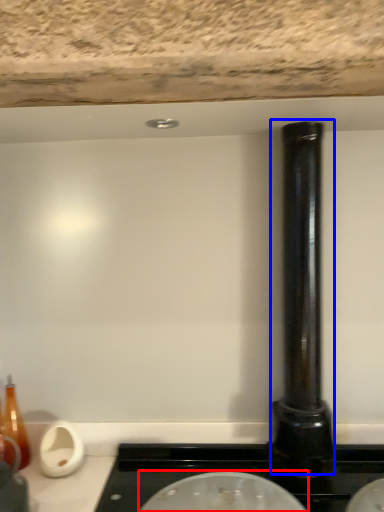
Question: Which object appears closest to the camera in this image, appliance (highlighted by a red box) or pillar (highlighted by a blue box)?

Choices:
 (A) appliance
 (B) pillar

Answer: (A)